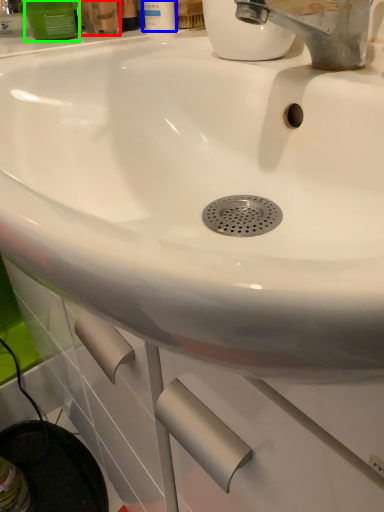
Question: Which is farther away from mouthwash (highlighted by a red box)? mouthwash (highlighted by a blue box) or mouthwash (highlighted by a green box)?

Choices:
 (A) mouthwash
 (B) mouthwash

Answer: (A)